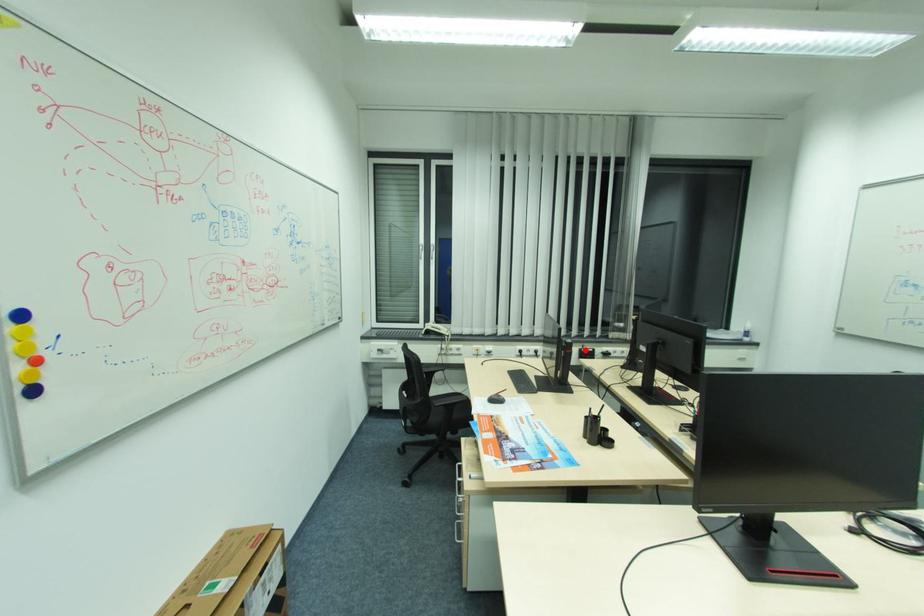
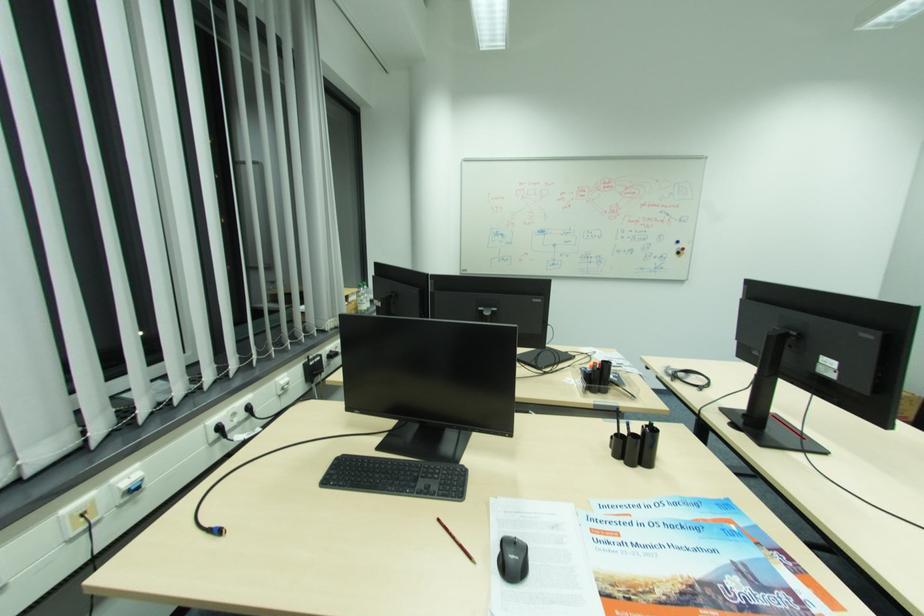
Find the pixel in the second image that matches the highlighted location in the first image.

(311, 365)